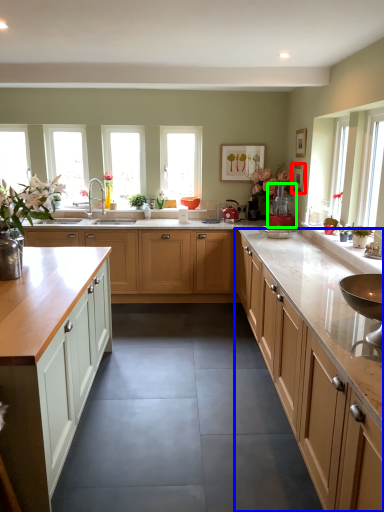
Question: Considering the real-world distances, which object is closest to picture frame (highlighted by a red box)? cabinetry (highlighted by a blue box) or appliance (highlighted by a green box).

Choices:
 (A) cabinetry
 (B) appliance

Answer: (B)